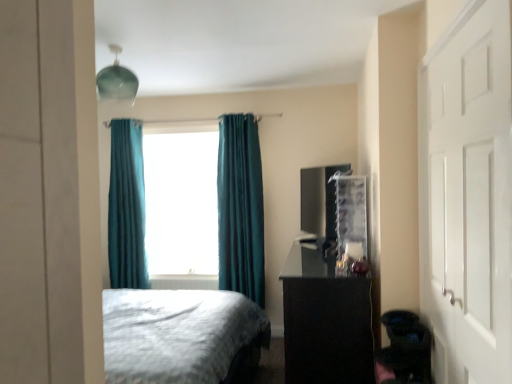
Where is `teal fabric curtain at center`? The height and width of the screenshot is (384, 512). teal fabric curtain at center is located at coordinates (181, 201).

Identify the location of teal velvet curtain at center, which ranks as the 1th curtain in right-to-left order. (240, 207).

You are a GUI agent. You are given a task and a screenshot of the screen. Output one action in this format:
    pyautogui.click(x=<x>, y=<y>)
    Task: Click on the white matte door at right
    The image size is (512, 384).
    Given the screenshot: What is the action you would take?
    pyautogui.click(x=468, y=195)

The height and width of the screenshot is (384, 512). I want to click on teal fabric curtain at center, so click(x=181, y=201).

Is teal fabric curtain at center facing away from teal velvet curtain at center, the second curtain viewed from the right?

No, teal fabric curtain at center is not facing away from teal velvet curtain at center, the second curtain viewed from the right.

Consider the image. From the image's perspective, is teal fabric curtain at center above or below teal velvet curtain at center, the second curtain viewed from the right?

Clearly, from the image's perspective, teal fabric curtain at center is above teal velvet curtain at center, the second curtain viewed from the right.

Between teal fabric curtain at center and teal velvet curtain at center, the second curtain viewed from the right, which one has smaller width?

teal velvet curtain at center, the second curtain viewed from the right, is thinner.

Is point (176, 212) farther from camera compared to point (127, 181)?

Yes, it is.

Are teal velvet curtain at center, the second curtain viewed from the right, and teal fabric curtain at center located far from each other?

teal velvet curtain at center, the second curtain viewed from the right, is actually quite close to teal fabric curtain at center.

Considering the positions of objects teal velvet curtain at center, the 1th curtain in the left-to-right sequence, and teal fabric curtain at center in the image provided, who is in front, teal velvet curtain at center, the 1th curtain in the left-to-right sequence, or teal fabric curtain at center?

teal velvet curtain at center, the 1th curtain in the left-to-right sequence.

Is teal velvet curtain at center, the 1th curtain in the left-to-right sequence, facing towards teal fabric curtain at center?

No.

Between teal velvet curtain at center, the second curtain viewed from the right, and teal fabric curtain at center, which one appears on the right side from the viewer's perspective?

teal fabric curtain at center.

Considering the relative sizes of teal velvet curtain at center, which ranks as the 1th curtain in right-to-left order, and white matte door at right in the image provided, is teal velvet curtain at center, which ranks as the 1th curtain in right-to-left order, thinner than white matte door at right?

Incorrect, the width of teal velvet curtain at center, which ranks as the 1th curtain in right-to-left order, is not less than that of white matte door at right.

Which object is closer to the camera, teal velvet curtain at center, which ranks as the 1th curtain in right-to-left order, or white matte door at right?

white matte door at right.

From the image's perspective, relative to white matte door at right, is teal velvet curtain at center, which ranks as the 1th curtain in right-to-left order, above or below?

Based on their image positions, teal velvet curtain at center, which ranks as the 1th curtain in right-to-left order, is located above white matte door at right.

Is teal velvet curtain at center, which ranks as the 1th curtain in right-to-left order, far away from white matte door at right?

Yes, teal velvet curtain at center, which ranks as the 1th curtain in right-to-left order, and white matte door at right are located far from each other.

Is teal fabric curtain at center thinner than white matte door at right?

No.

Does teal fabric curtain at center turn towards white matte door at right?

No, teal fabric curtain at center is not turned towards white matte door at right.

How many degrees apart are the facing directions of teal fabric curtain at center and white matte door at right?

The angle between the facing direction of teal fabric curtain at center and the facing direction of white matte door at right is 91 degrees.

Does point (212, 218) lie in front of point (510, 298)?

No, (212, 218) is behind (510, 298).

Is teal velvet curtain at center, the second curtain viewed from the right, facing towards teal velvet curtain at center, positioned as the 2th curtain in left-to-right order?

No, teal velvet curtain at center, the second curtain viewed from the right, is not turned towards teal velvet curtain at center, positioned as the 2th curtain in left-to-right order.

What's the angular difference between teal velvet curtain at center, the 1th curtain in the left-to-right sequence, and teal velvet curtain at center, positioned as the 2th curtain in left-to-right order,'s facing directions?

1.85 degrees.

From a real-world perspective, does teal velvet curtain at center, the 1th curtain in the left-to-right sequence, stand above teal velvet curtain at center, positioned as the 2th curtain in left-to-right order?

Yes, from a real-world perspective, teal velvet curtain at center, the 1th curtain in the left-to-right sequence, is on top of teal velvet curtain at center, positioned as the 2th curtain in left-to-right order.

Based on their sizes in the image, would you say teal velvet curtain at center, the second curtain viewed from the right, is bigger or smaller than teal velvet curtain at center, which ranks as the 1th curtain in right-to-left order?

Considering their sizes, teal velvet curtain at center, the second curtain viewed from the right, takes up less space than teal velvet curtain at center, which ranks as the 1th curtain in right-to-left order.

Based on the photo, is white matte door at right not inside teal fabric curtain at center?

Yes.

Which of these two, white matte door at right or teal fabric curtain at center, stands shorter?

Standing shorter between the two is teal fabric curtain at center.

Between white matte door at right and teal fabric curtain at center, which one has smaller width?

With smaller width is white matte door at right.

How distant is white matte door at right from teal fabric curtain at center?

A distance of 9.31 feet exists between white matte door at right and teal fabric curtain at center.

Is black glossy vanity at right oriented towards teal fabric curtain at center?

No, black glossy vanity at right is not oriented towards teal fabric curtain at center.

You are a GUI agent. You are given a task and a screenshot of the screen. Output one action in this format:
    pyautogui.click(x=<x>, y=<y>)
    Task: Click on the window on the left of black glossy vanity at right
    The height and width of the screenshot is (384, 512).
    Given the screenshot: What is the action you would take?
    pyautogui.click(x=181, y=201)

Image resolution: width=512 pixels, height=384 pixels. I want to click on window behind the teal velvet curtain at center, the second curtain viewed from the right, so click(x=181, y=201).

The image size is (512, 384). What are the coordinates of `the 1st curtain positioned below the teal fabric curtain at center (from a real-world perspective)` in the screenshot? It's located at (127, 207).

Based on their spatial positions, is white matte door at right or teal velvet curtain at center, the second curtain viewed from the right, further from teal velvet curtain at center, which ranks as the 1th curtain in right-to-left order?

The object further to teal velvet curtain at center, which ranks as the 1th curtain in right-to-left order, is white matte door at right.

Considering their positions, is teal velvet curtain at center, the second curtain viewed from the right, positioned further to teal velvet curtain at center, positioned as the 2th curtain in left-to-right order, than teal fabric curtain at center?

Among the two, teal velvet curtain at center, the second curtain viewed from the right, is located further to teal velvet curtain at center, positioned as the 2th curtain in left-to-right order.

When comparing their distances from black glossy vanity at right, does teal fabric curtain at center or teal velvet curtain at center, positioned as the 2th curtain in left-to-right order, seem further?

teal fabric curtain at center is positioned further to the anchor black glossy vanity at right.

Looking at the image, which one is located closer to white matte door at right, teal fabric curtain at center or teal velvet curtain at center, positioned as the 2th curtain in left-to-right order?

teal velvet curtain at center, positioned as the 2th curtain in left-to-right order, is positioned closer to the anchor white matte door at right.

Estimate the real-world distances between objects in this image. Which object is closer to teal fabric curtain at center, white matte door at right or teal velvet curtain at center, which ranks as the 1th curtain in right-to-left order?

teal velvet curtain at center, which ranks as the 1th curtain in right-to-left order, is closer to teal fabric curtain at center.

When comparing their distances from teal velvet curtain at center, the second curtain viewed from the right, does black glossy vanity at right or teal fabric curtain at center seem closer?

Among the two, teal fabric curtain at center is located nearer to teal velvet curtain at center, the second curtain viewed from the right.

Based on their spatial positions, is white matte door at right or teal velvet curtain at center, the second curtain viewed from the right, closer to teal fabric curtain at center?

teal velvet curtain at center, the second curtain viewed from the right, lies closer to teal fabric curtain at center than the other object.

Which object lies further to the anchor point black glossy vanity at right, teal velvet curtain at center, which ranks as the 1th curtain in right-to-left order, or teal velvet curtain at center, the 1th curtain in the left-to-right sequence?

teal velvet curtain at center, the 1th curtain in the left-to-right sequence.

What are the coordinates of `window located between teal velvet curtain at center, the second curtain viewed from the right, and teal velvet curtain at center, positioned as the 2th curtain in left-to-right order, in the left-right direction` in the screenshot? It's located at (181, 201).

This screenshot has width=512, height=384. I want to click on curtain between white matte door at right and teal velvet curtain at center, the second curtain viewed from the right, in the front-back direction, so click(240, 207).

Where is `vanity located between white matte door at right and teal velvet curtain at center, the second curtain viewed from the right, in the depth direction`? Image resolution: width=512 pixels, height=384 pixels. vanity located between white matte door at right and teal velvet curtain at center, the second curtain viewed from the right, in the depth direction is located at coordinates (325, 321).

Where is `vanity positioned between white matte door at right and teal fabric curtain at center from near to far`? vanity positioned between white matte door at right and teal fabric curtain at center from near to far is located at coordinates (325, 321).